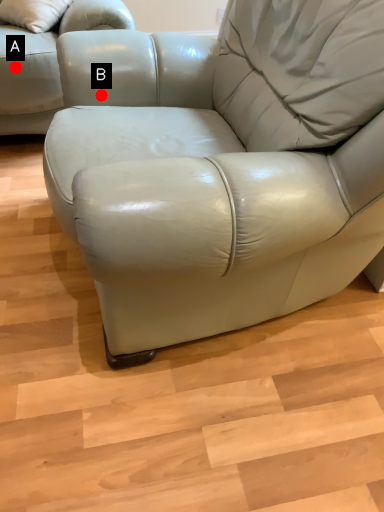
Question: Two points are circled on the image, labeled by A and B beside each circle. Which of the following is the closest to the observer?

Choices:
 (A) A is closer
 (B) B is closer

Answer: (B)